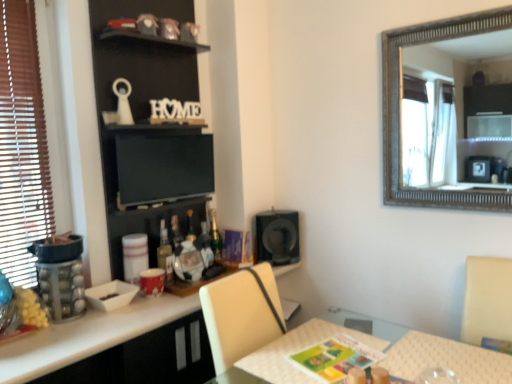
Question: From the image's perspective, is black matte bookshelf at upper left on green glass bottle at center, which is counted as the first bottle, starting from the right?

Choices:
 (A) yes
 (B) no

Answer: (A)

Question: From a real-world perspective, is black matte bookshelf at upper left positioned over green glass bottle at center, positioned as the second bottle in left-to-right order, based on gravity?

Choices:
 (A) no
 (B) yes

Answer: (B)

Question: Is there a large distance between black matte bookshelf at upper left and green glass bottle at center, the 2th bottle viewed from the front?

Choices:
 (A) yes
 (B) no

Answer: (B)

Question: Does black matte bookshelf at upper left have a larger size compared to green glass bottle at center, which is counted as the first bottle, starting from the right?

Choices:
 (A) no
 (B) yes

Answer: (B)

Question: Does black matte bookshelf at upper left have a smaller size compared to green glass bottle at center, the 2th bottle viewed from the front?

Choices:
 (A) yes
 (B) no

Answer: (B)

Question: Is point (181, 150) closer or farther from the camera than point (216, 231)?

Choices:
 (A) farther
 (B) closer

Answer: (B)

Question: In terms of height, does black matte bookshelf at upper left look taller or shorter compared to green glass bottle at center, the 2th bottle viewed from the front?

Choices:
 (A) short
 (B) tall

Answer: (B)

Question: From the image's perspective, is black matte bookshelf at upper left located above or below green glass bottle at center, which is counted as the first bottle, starting from the right?

Choices:
 (A) below
 (B) above

Answer: (B)

Question: Is black matte bookshelf at upper left bigger or smaller than green glass bottle at center, positioned as the second bottle in left-to-right order?

Choices:
 (A) big
 (B) small

Answer: (A)

Question: Considering the positions of matte glass bottle at center, the 1th bottle when ordered from front to back, and green glass bottle at center, which is counted as the first bottle, starting from the right, in the image, is matte glass bottle at center, the 1th bottle when ordered from front to back, taller or shorter than green glass bottle at center, which is counted as the first bottle, starting from the right,?

Choices:
 (A) tall
 (B) short

Answer: (B)

Question: Considering the positions of matte glass bottle at center, the second bottle viewed from the back, and green glass bottle at center, the 1th bottle positioned from the back, in the image, is matte glass bottle at center, the second bottle viewed from the back, wider or thinner than green glass bottle at center, the 1th bottle positioned from the back,?

Choices:
 (A) wide
 (B) thin

Answer: (A)

Question: Looking at the image, does matte glass bottle at center, the second bottle in the right-to-left sequence, seem bigger or smaller compared to green glass bottle at center, which is counted as the first bottle, starting from the right?

Choices:
 (A) small
 (B) big

Answer: (B)

Question: From the image's perspective, relative to green glass bottle at center, which is counted as the first bottle, starting from the right, is matte glass bottle at center, the second bottle viewed from the back, above or below?

Choices:
 (A) below
 (B) above

Answer: (A)

Question: From a real-world perspective, is green glass bottle at center, positioned as the second bottle in left-to-right order, above or below black matte bookshelf at upper left?

Choices:
 (A) below
 (B) above

Answer: (A)

Question: In the image, is green glass bottle at center, positioned as the second bottle in left-to-right order, positioned in front of or behind black matte bookshelf at upper left?

Choices:
 (A) front
 (B) behind

Answer: (B)